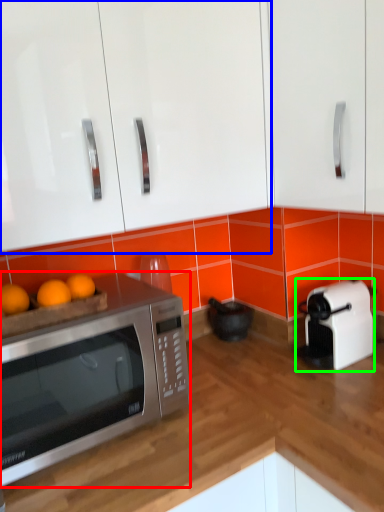
Question: Which object is the closest to the microwave oven (highlighted by a red box)? Choose among these: cabinetry (highlighted by a blue box) or toaster (highlighted by a green box).

Choices:
 (A) cabinetry
 (B) toaster

Answer: (A)